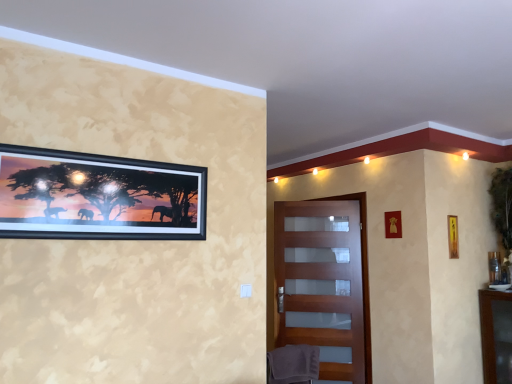
Question: Is matte wooden door at center facing towards gray fabric swivel chair at lower center?

Choices:
 (A) yes
 (B) no

Answer: (A)

Question: Is matte wooden door at center wider than gray fabric swivel chair at lower center?

Choices:
 (A) no
 (B) yes

Answer: (A)

Question: Is the position of matte wooden door at center less distant than that of gray fabric swivel chair at lower center?

Choices:
 (A) yes
 (B) no

Answer: (B)

Question: From the image's perspective, does matte wooden door at center appear lower than gray fabric swivel chair at lower center?

Choices:
 (A) no
 (B) yes

Answer: (A)

Question: Considering the relative positions of matte wooden door at center and gray fabric swivel chair at lower center in the image provided, is matte wooden door at center to the left of gray fabric swivel chair at lower center from the viewer's perspective?

Choices:
 (A) yes
 (B) no

Answer: (B)

Question: Can you confirm if matte wooden door at center is thinner than gray fabric swivel chair at lower center?

Choices:
 (A) no
 (B) yes

Answer: (B)

Question: Can metallic gold picture frame at right, which is the fourth picture frame in front-to-back order, be found inside gray fabric swivel chair at lower center?

Choices:
 (A) no
 (B) yes

Answer: (A)

Question: From the image's perspective, is gray fabric swivel chair at lower center located above metallic gold picture frame at right, which is counted as the 1th picture frame, starting from the right?

Choices:
 (A) yes
 (B) no

Answer: (B)

Question: Is gray fabric swivel chair at lower center thinner than metallic gold picture frame at right, which is counted as the 1th picture frame, starting from the right?

Choices:
 (A) no
 (B) yes

Answer: (A)

Question: Can you confirm if gray fabric swivel chair at lower center is smaller than metallic gold picture frame at right, which is counted as the 1th picture frame, starting from the right?

Choices:
 (A) yes
 (B) no

Answer: (B)

Question: Is gray fabric swivel chair at lower center closer to camera compared to metallic gold picture frame at right, which is the fourth picture frame in front-to-back order?

Choices:
 (A) no
 (B) yes

Answer: (B)

Question: Does gray fabric swivel chair at lower center touch metallic gold picture frame at right, which is the fourth picture frame in front-to-back order?

Choices:
 (A) yes
 (B) no

Answer: (B)

Question: From the image's perspective, is metallic gold picture frame at upper right, the second picture frame in the back-to-front sequence, above metallic gold picture frame at right, positioned as the fourth picture frame in left-to-right order?

Choices:
 (A) no
 (B) yes

Answer: (B)